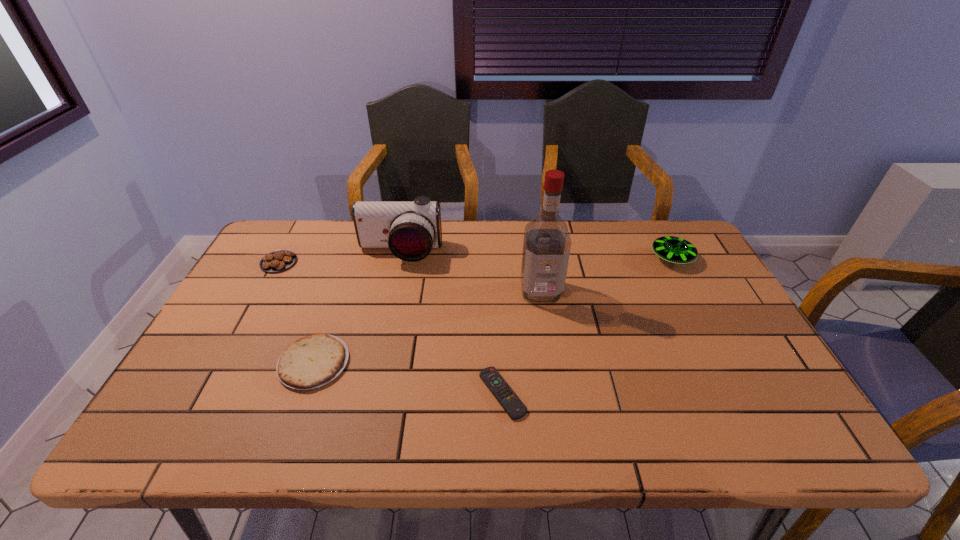
Identify the location of vacant space that satisfies the following two spatial constraints: 1. on the surface of the second tallest object; 2. on the left side of the fourth object from left to right. The width and height of the screenshot is (960, 540). (369, 393).